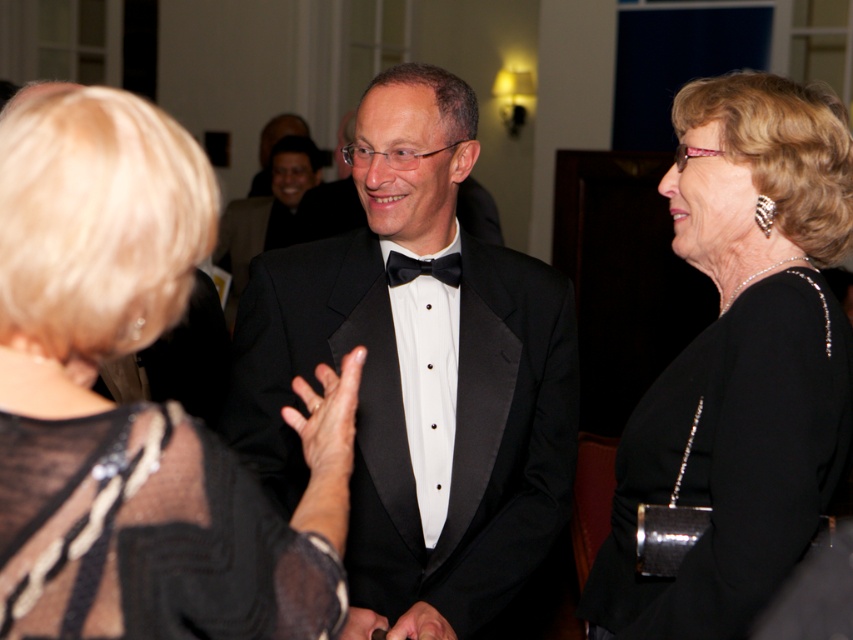
Based on the photo, you are at a formal event and want to take a photo of the black satin dress at right and the black satin bow tie at center. Which one will appear larger in the photo?

The black satin dress at right is closer to the viewer than the black satin bow tie at center, so it will appear larger in the photo.

You are at the entrance of the room and want to greet the person wearing the black lace dress at center. In which direction should you walk to reach them?

The black lace dress at center is located at point 0.634 on the x axis and 0.162 on the y axis, so you should walk towards the center of the room to reach them.